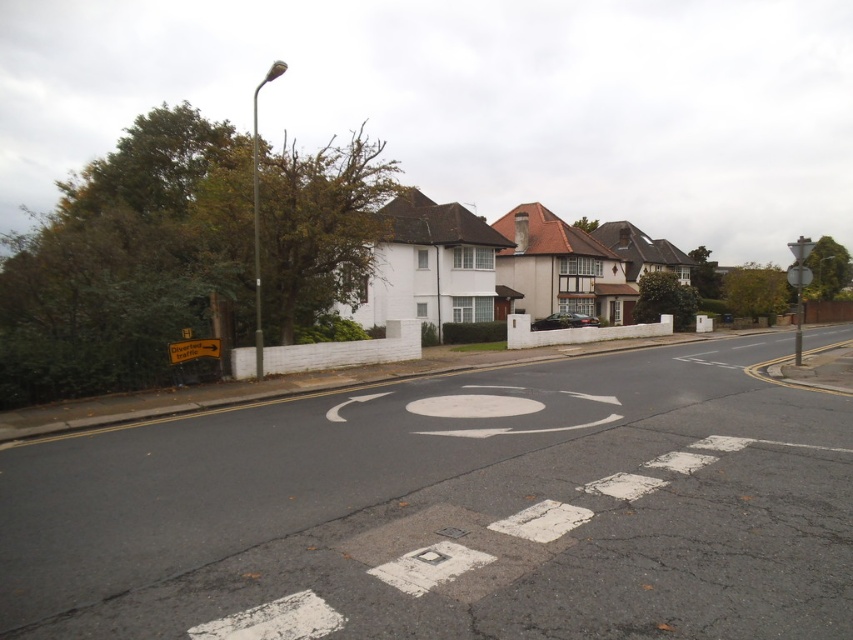
Question: Which is farther from the white painted circle at center?

Choices:
 (A) yellow plastic sign at lower left
 (B) metallic silver street sign at right

Answer: (B)

Question: Can you confirm if white painted circle at center is smaller than metallic silver street sign at right?

Choices:
 (A) yes
 (B) no

Answer: (A)

Question: Which object is positioned farthest from the metallic silver street sign at right?

Choices:
 (A) yellow plastic sign at lower left
 (B) white painted circle at center

Answer: (B)

Question: Where is white painted circle at center located in relation to yellow plastic sign at lower left in the image?

Choices:
 (A) left
 (B) right

Answer: (B)

Question: Where is white painted circle at center located in relation to yellow plastic sign at lower left in the image?

Choices:
 (A) above
 (B) below

Answer: (B)

Question: Which object appears closest to the camera in this image?

Choices:
 (A) white painted circle at center
 (B) metallic silver street sign at right
 (C) yellow plastic sign at lower left

Answer: (A)